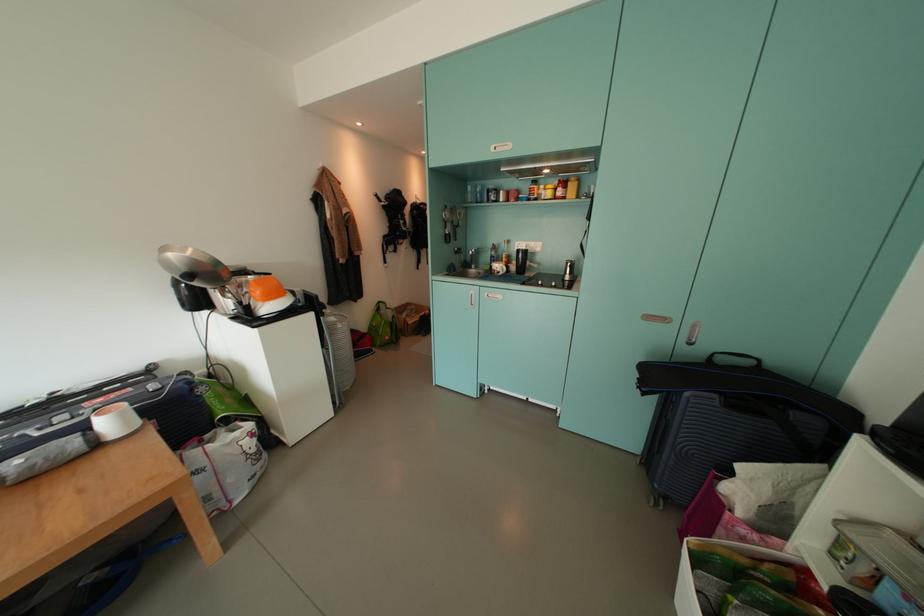
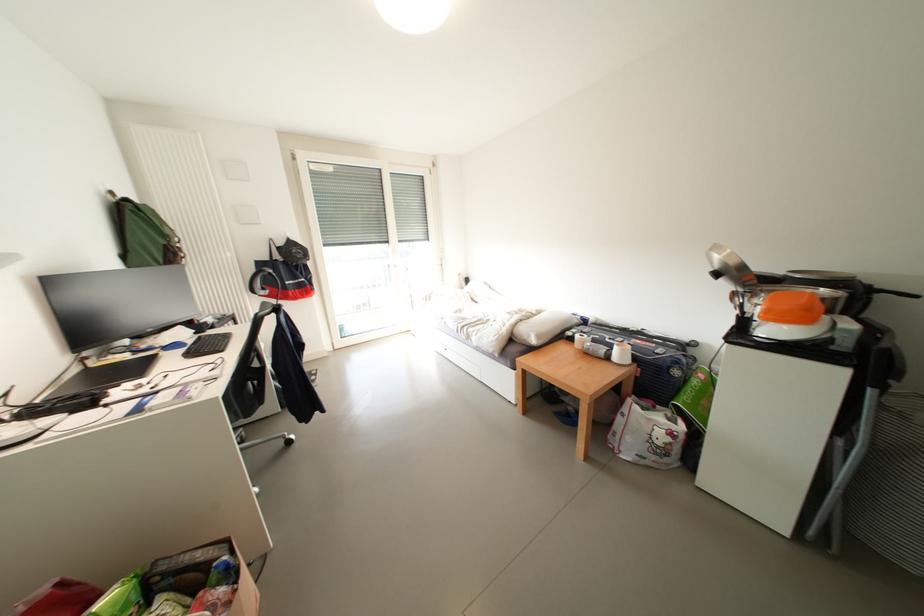
In the second image, find the point that corresponds to (210,444) in the first image.

(662, 410)